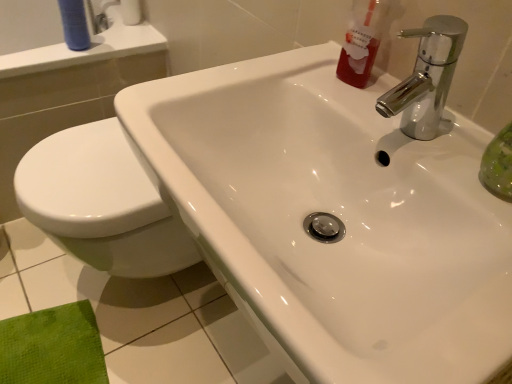
Locate an element on the screen. vacant space in front of white paper towel at upper left is located at coordinates (126, 36).